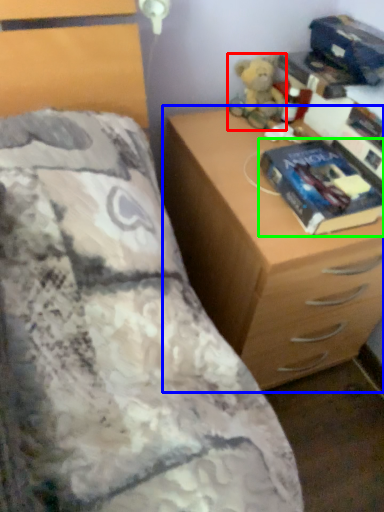
Question: Which object is the farthest from toy (highlighted by a red box)? Choose among these: chest of drawers (highlighted by a blue box) or paperback book (highlighted by a green box).

Choices:
 (A) chest of drawers
 (B) paperback book

Answer: (A)